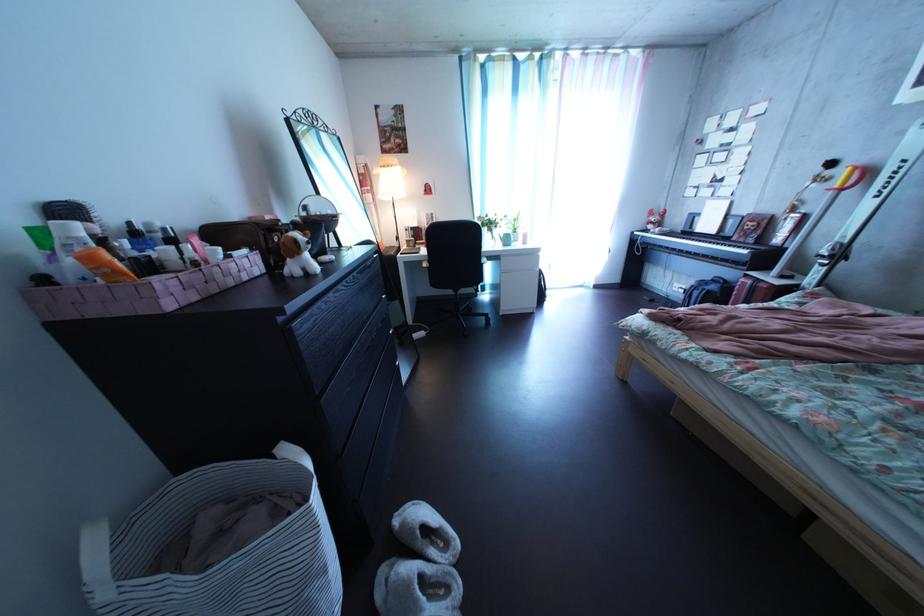
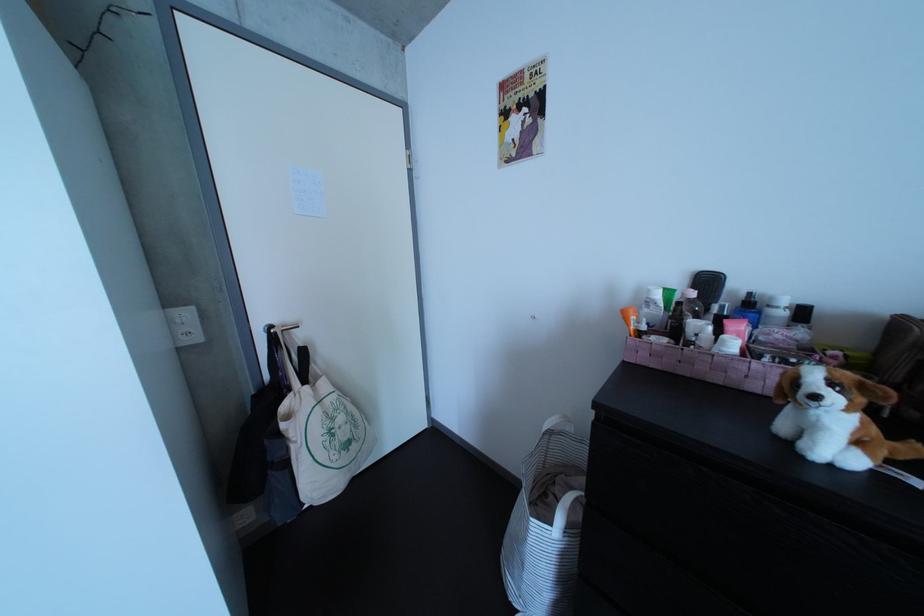
Question: I am providing you with two images of the same scene from different viewpoints. After the viewpoint changes to image2, which objects are now occluded?

Choices:
 (A) black hairbrush handle
 (B) white cosmetic bottle
 (C) blue spray nozzle
 (D) none of these

Answer: (D)